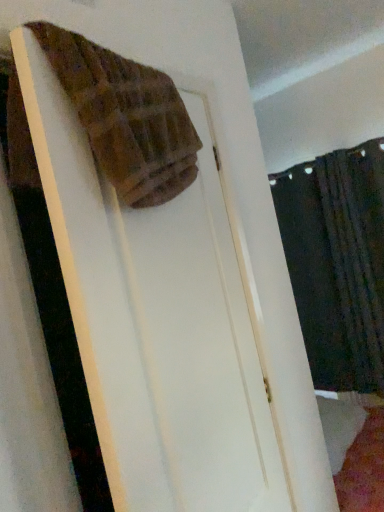
Question: Does point (59, 59) appear closer or farther from the camera than point (304, 183)?

Choices:
 (A) farther
 (B) closer

Answer: (B)

Question: From a real-world perspective, is brown woven towel at upper left positioned above or below dark fabric curtain at right?

Choices:
 (A) below
 (B) above

Answer: (B)

Question: Is brown woven towel at upper left wider or thinner than dark fabric curtain at right?

Choices:
 (A) thin
 (B) wide

Answer: (B)

Question: Does point (380, 202) appear closer or farther from the camera than point (168, 160)?

Choices:
 (A) farther
 (B) closer

Answer: (A)

Question: In the image, is dark fabric curtain at right on the left side or the right side of brown woven towel at upper left?

Choices:
 (A) right
 (B) left

Answer: (A)

Question: Considering the positions of dark fabric curtain at right and brown woven towel at upper left in the image, is dark fabric curtain at right wider or thinner than brown woven towel at upper left?

Choices:
 (A) thin
 (B) wide

Answer: (A)

Question: Choose the correct answer: Is dark fabric curtain at right inside brown woven towel at upper left or outside it?

Choices:
 (A) inside
 (B) outside

Answer: (B)